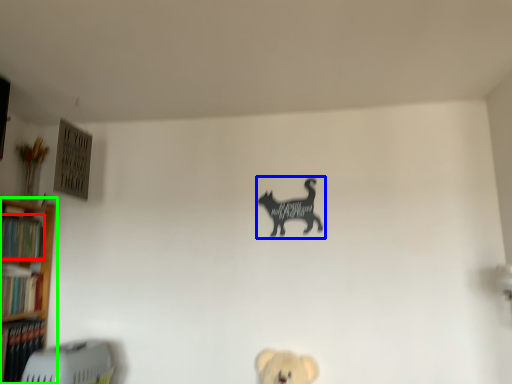
Question: Which object is the closest to the book (highlighted by a red box)? Choose among these: animal (highlighted by a blue box) or shelf (highlighted by a green box).

Choices:
 (A) animal
 (B) shelf

Answer: (B)